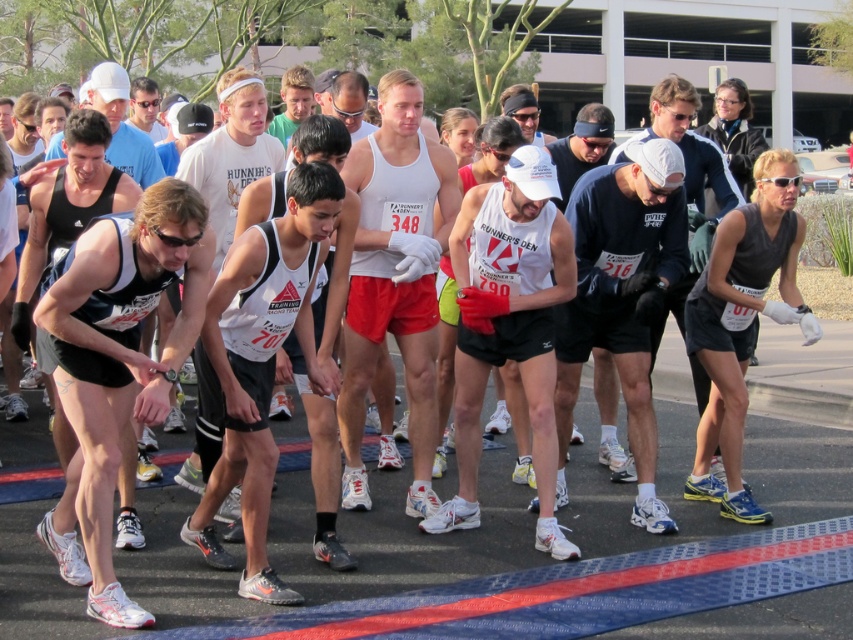
Is white matte tank top at center thinner than dark blue fabric shirt at center?

In fact, white matte tank top at center might be wider than dark blue fabric shirt at center.

In the scene shown: Can you confirm if white matte tank top at center is taller than dark blue fabric shirt at center?

Yes, white matte tank top at center is taller than dark blue fabric shirt at center.

Locate an element on the screen. The image size is (853, 640). white matte tank top at center is located at coordinates (395, 278).

Can you confirm if dark blue fabric shirt at center is wider than dark gray fabric tank top at center?

Yes.

Can you confirm if dark blue fabric shirt at center is smaller than dark gray fabric tank top at center?

Yes.

Which is in front, point (686, 260) or point (718, 433)?

Positioned in front is point (686, 260).

Where is `dark blue fabric shirt at center`? The image size is (853, 640). dark blue fabric shirt at center is located at coordinates (621, 298).

Is dark gray fabric tank top at center further to the viewer compared to matte black tank top at center?

No, dark gray fabric tank top at center is in front of matte black tank top at center.

Where is `dark gray fabric tank top at center`? dark gray fabric tank top at center is located at coordinates (743, 317).

Locate an element on the screen. dark gray fabric tank top at center is located at coordinates (743, 317).